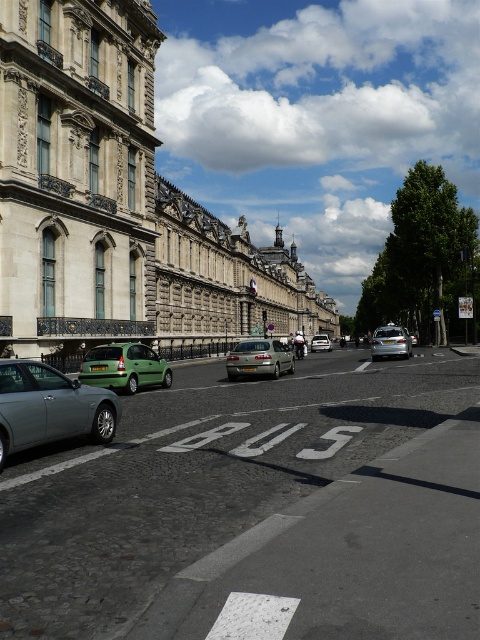
You are standing at the intersection and need to cross the street to reach the historic buildings. The bus lane is marked with a white BUS sign. Is the matte silver car at center blocking your path to the buildings?

The matte silver car at center is located at point (256,508), which is on the road. Since the road has cobblestones in the foreground and asphalt further down with the bus lane, the car is likely in the bus lane area. This position would block your path to the historic buildings on the other side of the street.

Consider the image. You are standing at the point marked by the coordinates (x=49, y=406) in the image. What object is located at this point?

The point marked by the coordinates (x=49, y=406) indicates the location of the silver metallic car at lower left.

You are a pedestrian standing at the intersection and want to cross the street. There are two silver metallic cars in front of you. The silver metallic car at lower left and the silver metallic sedan at center. Which car is closer to you?

The silver metallic car at lower left is closer to you because it is in front of the silver metallic sedan at center.